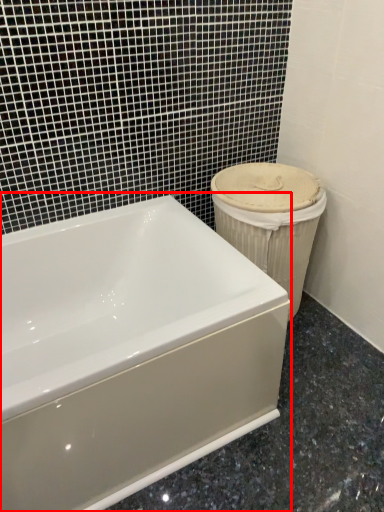
Question: From the image's perspective, what is the correct spatial relationship of bathtub (annotated by the red box) in relation to porcelain?

Choices:
 (A) above
 (B) below

Answer: (B)